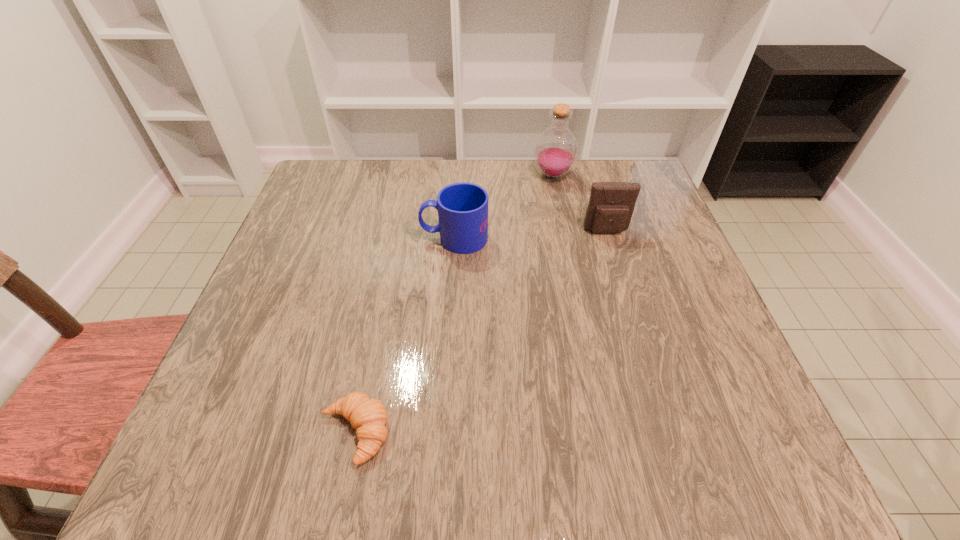
The height and width of the screenshot is (540, 960). I want to click on vacant space that's between the mug and the crescent roll, so click(405, 335).

In order to click on free spot between the leftmost object and the mug in this screenshot , I will do pos(405,335).

The height and width of the screenshot is (540, 960). I want to click on the third closest object to the pouch, so click(x=368, y=416).

Identify the location of object that is the closest to the tallest object. (611, 205).

Find the location of `free spot that satisfies the following two spatial constraints: 1. with an open flap on the pouch; 2. on the side with the handle of the mug`. free spot that satisfies the following two spatial constraints: 1. with an open flap on the pouch; 2. on the side with the handle of the mug is located at coordinates (609, 238).

Where is `blank area in the image that satisfies the following two spatial constraints: 1. on the front side of the tallest object; 2. on the side with the handle of the mug`? The width and height of the screenshot is (960, 540). blank area in the image that satisfies the following two spatial constraints: 1. on the front side of the tallest object; 2. on the side with the handle of the mug is located at coordinates (565, 238).